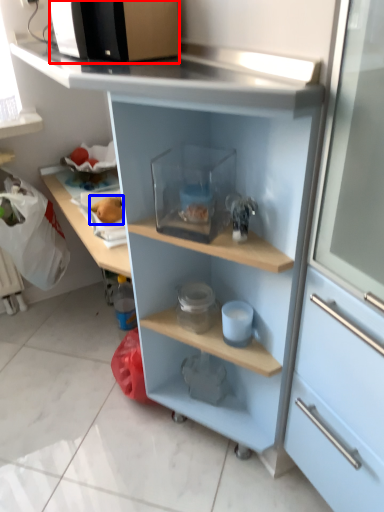
Question: Which point is further to the camera, microwave oven (highlighted by a red box) or food (highlighted by a blue box)?

Choices:
 (A) microwave oven
 (B) food

Answer: (B)